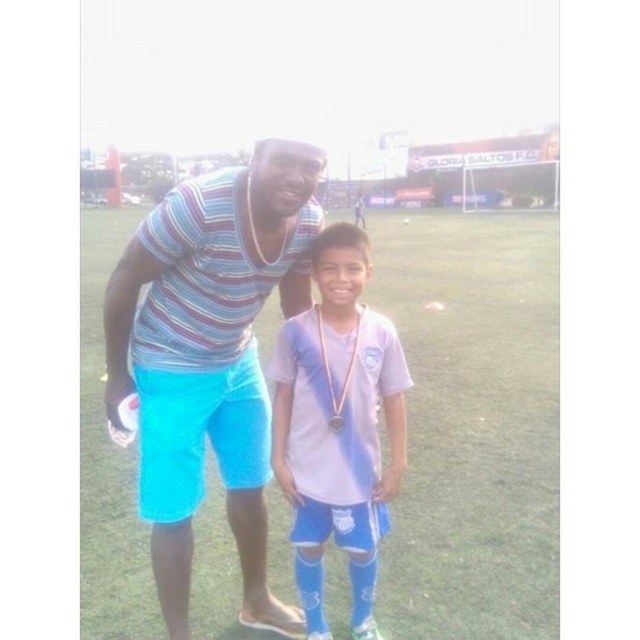
You are standing on the soccer field and see two points marked on the field. The first point is at coordinates point (536,484) and the second is at point (314,316). Which point is closer to you?

Point (536,484) is further to the viewer than point (314,316), so the point closer to you is point (314,316).